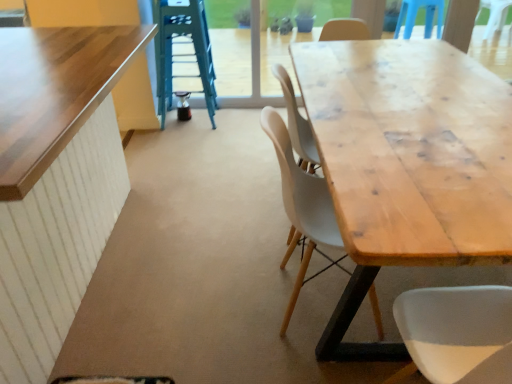
Question: Considering the relative positions of matte wood chair at center and green metallic ladder at upper center in the image provided, is matte wood chair at center to the left of green metallic ladder at upper center from the viewer's perspective?

Choices:
 (A) no
 (B) yes

Answer: (A)

Question: Does matte wood chair at center have a smaller size compared to green metallic ladder at upper center?

Choices:
 (A) no
 (B) yes

Answer: (B)

Question: Is there a large distance between matte wood chair at center and green metallic ladder at upper center?

Choices:
 (A) yes
 (B) no

Answer: (A)

Question: Is the surface of matte wood chair at center in direct contact with green metallic ladder at upper center?

Choices:
 (A) no
 (B) yes

Answer: (A)

Question: Can you confirm if matte wood chair at center is shorter than green metallic ladder at upper center?

Choices:
 (A) yes
 (B) no

Answer: (A)

Question: Can we say matte wood chair at center lies outside green metallic ladder at upper center?

Choices:
 (A) no
 (B) yes

Answer: (B)

Question: Is green metallic ladder at upper center in contact with wooden table at left, the 1th table viewed from the left?

Choices:
 (A) yes
 (B) no

Answer: (B)

Question: From a real-world perspective, is green metallic ladder at upper center physically above wooden table at left, marked as the second table in a right-to-left arrangement?

Choices:
 (A) no
 (B) yes

Answer: (B)

Question: Is green metallic ladder at upper center oriented towards wooden table at left, the 1th table viewed from the left?

Choices:
 (A) yes
 (B) no

Answer: (A)

Question: Is green metallic ladder at upper center not near wooden table at left, marked as the second table in a right-to-left arrangement?

Choices:
 (A) no
 (B) yes

Answer: (B)

Question: Does green metallic ladder at upper center have a greater width compared to wooden table at left, the 1th table viewed from the left?

Choices:
 (A) no
 (B) yes

Answer: (A)

Question: Is green metallic ladder at upper center further to camera compared to wooden table at left, marked as the second table in a right-to-left arrangement?

Choices:
 (A) yes
 (B) no

Answer: (A)

Question: Considering the relative sizes of green metallic ladder at upper center and natural wood table at center, the 2th table when ordered from left to right, in the image provided, is green metallic ladder at upper center bigger than natural wood table at center, the 2th table when ordered from left to right,?

Choices:
 (A) yes
 (B) no

Answer: (B)